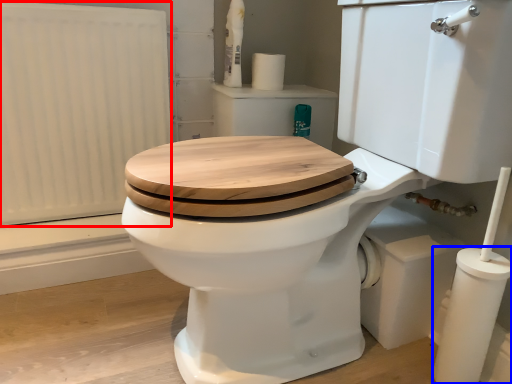
Question: Among these objects, which one is nearest to the camera, radiator (highlighted by a red box) or pillar (highlighted by a blue box)?

Choices:
 (A) radiator
 (B) pillar

Answer: (B)